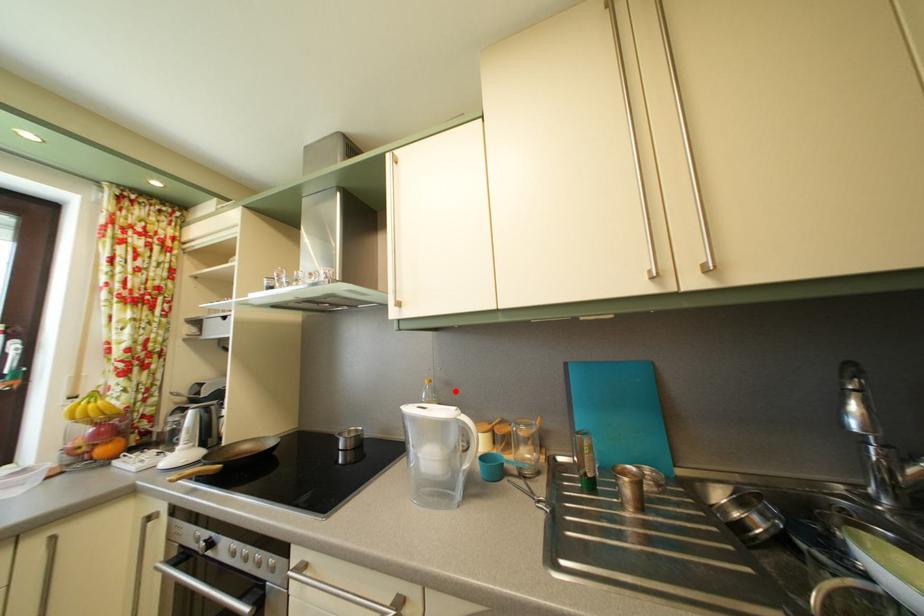
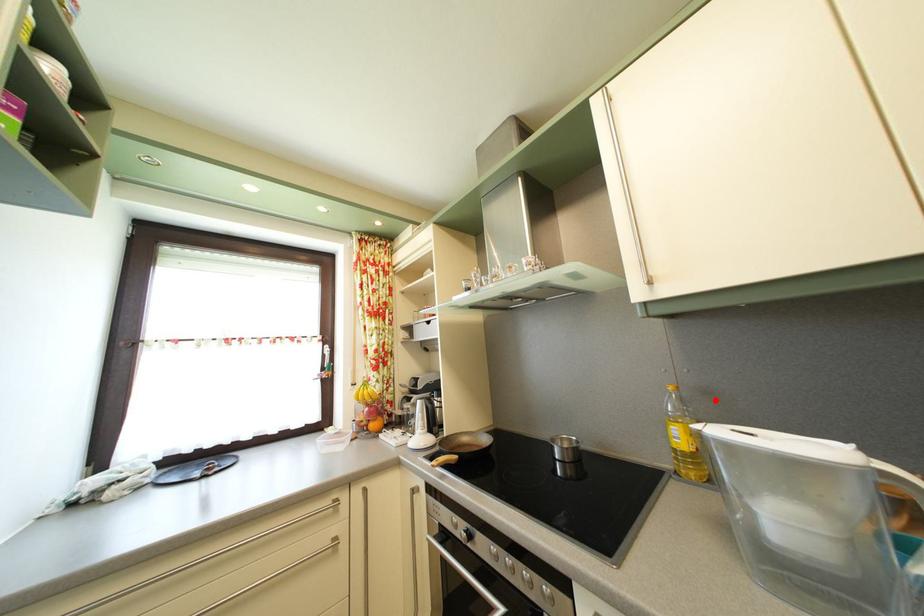
I am providing you with two images of the same scene from different viewpoints. A red point is marked on the first image and another point is marked on the second image. Is the red point in image1 aligned with the point shown in image2?

Yes